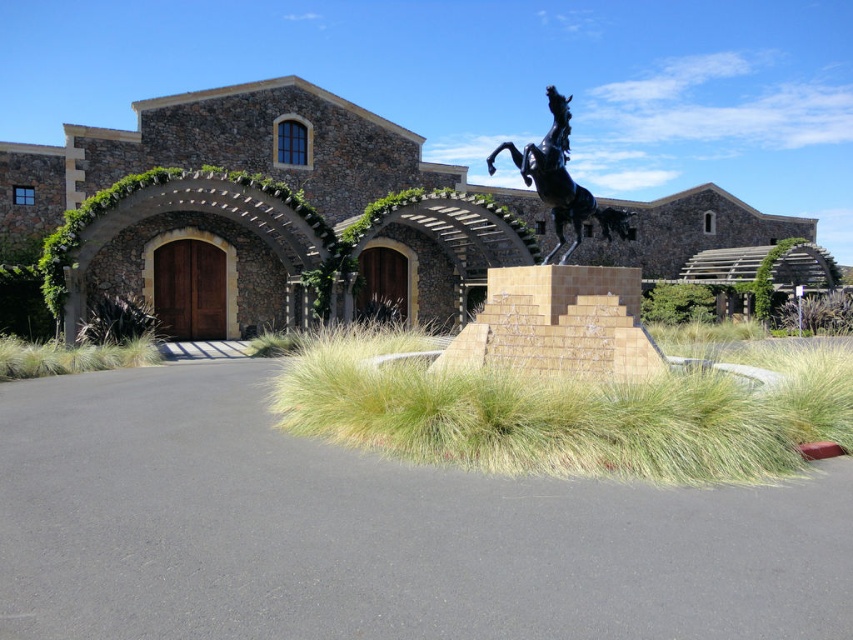
Question: Which point appears closest to the camera in this image?

Choices:
 (A) (480, 424)
 (B) (544, 163)

Answer: (A)

Question: Which of the following is the closest to the observer?

Choices:
 (A) black polished horse at center
 (B) green grass at lower left
 (C) green grass at center
 (D) black asphalt at center

Answer: (D)

Question: Can you confirm if black asphalt at center is positioned to the left of green grass at lower left?

Choices:
 (A) yes
 (B) no

Answer: (B)

Question: Is black asphalt at center bigger than green grass at lower left?

Choices:
 (A) yes
 (B) no

Answer: (A)

Question: Which point is farther from the camera taking this photo?

Choices:
 (A) (39, 368)
 (B) (492, 172)

Answer: (A)

Question: Does green grass at center have a smaller size compared to green grass at lower left?

Choices:
 (A) yes
 (B) no

Answer: (B)